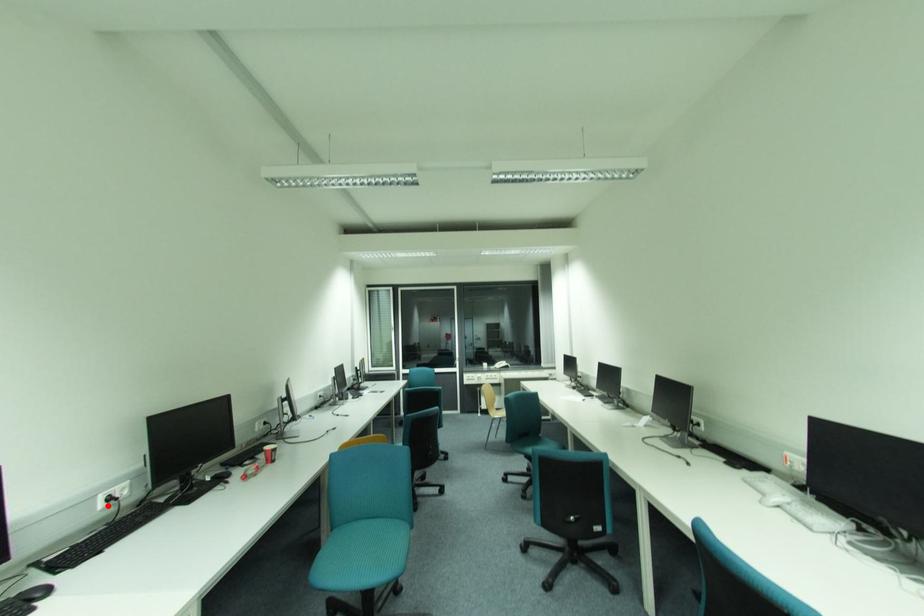
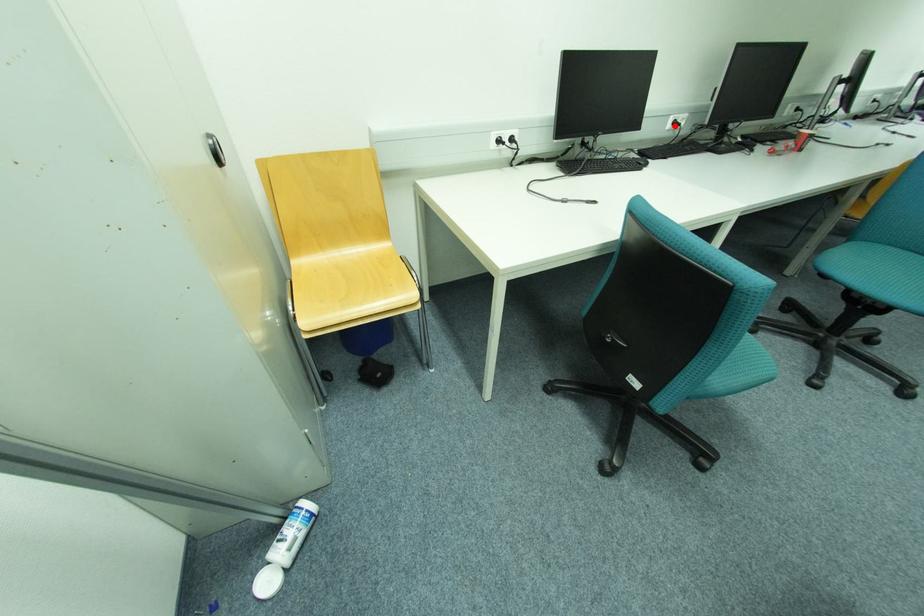
I am providing you with two images of the same scene from different viewpoints. A red point is marked on the first image and another point is marked on the second image. Are the points marked in image1 and image2 representing the same 3D position?

Yes